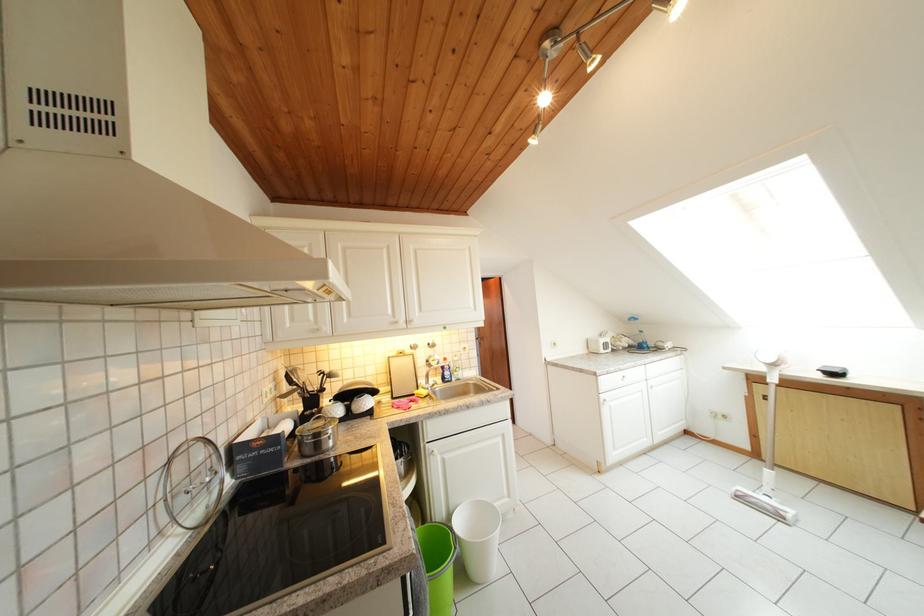
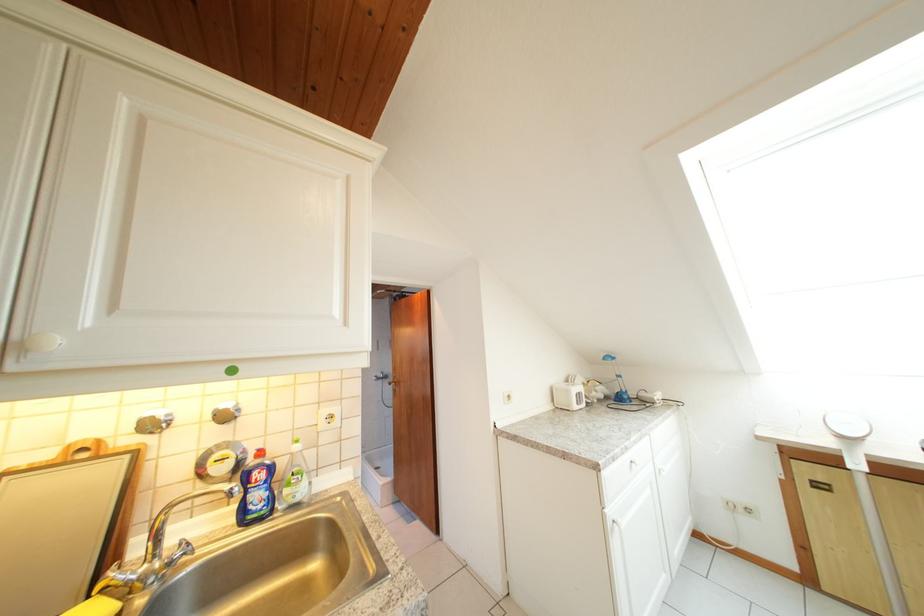
In the second image, find the point that corresponds to the point at 464,379 in the first image.

(295, 496)